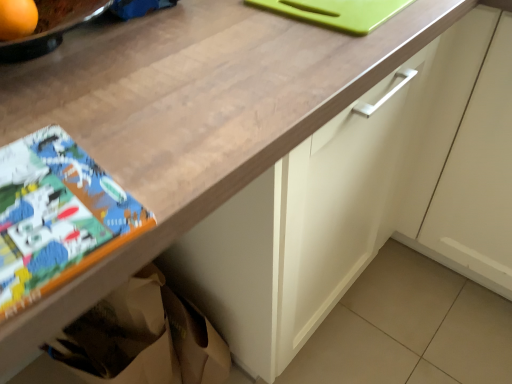
Question: Is matte paper comic book at lower left in contact with white matte cabinet at center?

Choices:
 (A) no
 (B) yes

Answer: (A)

Question: Would you say matte paper comic book at lower left is a long distance from white matte cabinet at center?

Choices:
 (A) yes
 (B) no

Answer: (B)

Question: Considering the relative sizes of matte paper comic book at lower left and white matte cabinet at center in the image provided, is matte paper comic book at lower left bigger than white matte cabinet at center?

Choices:
 (A) yes
 (B) no

Answer: (B)

Question: Does matte paper comic book at lower left have a greater height compared to white matte cabinet at center?

Choices:
 (A) no
 (B) yes

Answer: (A)

Question: From the image's perspective, is matte paper comic book at lower left on top of white matte cabinet at center?

Choices:
 (A) yes
 (B) no

Answer: (B)

Question: Choose the correct answer: Is matte paper comic book at lower left inside orange matte at upper left or outside it?

Choices:
 (A) outside
 (B) inside

Answer: (A)

Question: In terms of height, does matte paper comic book at lower left look taller or shorter compared to orange matte at upper left?

Choices:
 (A) tall
 (B) short

Answer: (B)

Question: Does point (16, 276) appear closer or farther from the camera than point (14, 26)?

Choices:
 (A) closer
 (B) farther

Answer: (A)

Question: From the image's perspective, is matte paper comic book at lower left located above or below orange matte at upper left?

Choices:
 (A) below
 (B) above

Answer: (A)

Question: Is white matte cabinet at center spatially inside matte paper comic book at lower left, or outside of it?

Choices:
 (A) inside
 (B) outside

Answer: (B)

Question: From their relative heights in the image, would you say white matte cabinet at center is taller or shorter than matte paper comic book at lower left?

Choices:
 (A) tall
 (B) short

Answer: (A)

Question: Visually, is white matte cabinet at center positioned to the left or to the right of matte paper comic book at lower left?

Choices:
 (A) left
 (B) right

Answer: (B)

Question: Is white matte cabinet at center wider or thinner than matte paper comic book at lower left?

Choices:
 (A) wide
 (B) thin

Answer: (A)

Question: Is orange matte at upper left situated inside white matte cabinet at center or outside?

Choices:
 (A) outside
 (B) inside

Answer: (A)

Question: Looking at the image, does orange matte at upper left seem bigger or smaller compared to white matte cabinet at center?

Choices:
 (A) big
 (B) small

Answer: (B)